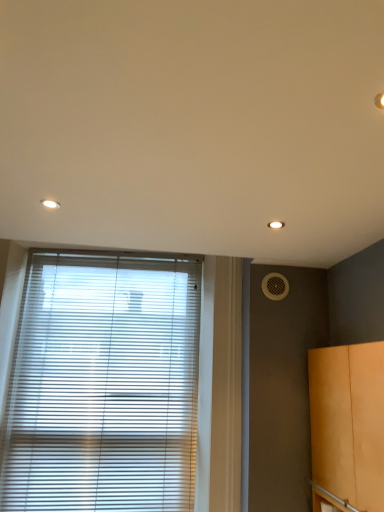
Question: Is point (64, 263) closer or farther from the camera than point (269, 297)?

Choices:
 (A) farther
 (B) closer

Answer: (A)

Question: Is white plastic blinds at lower left spatially inside white mesh air conditioning at right, or outside of it?

Choices:
 (A) inside
 (B) outside

Answer: (B)

Question: Based on their relative distances, which object is farther from the matte orange cabinet at right?

Choices:
 (A) white mesh air conditioning at right
 (B) white plastic blinds at lower left

Answer: (B)

Question: Which object is positioned farthest from the white plastic blinds at lower left?

Choices:
 (A) matte orange cabinet at right
 (B) white mesh air conditioning at right

Answer: (A)